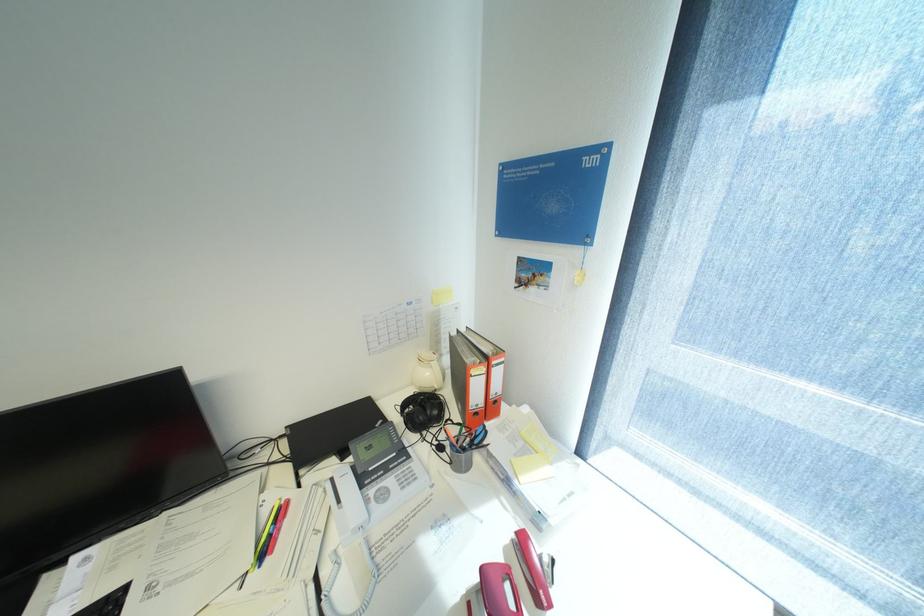
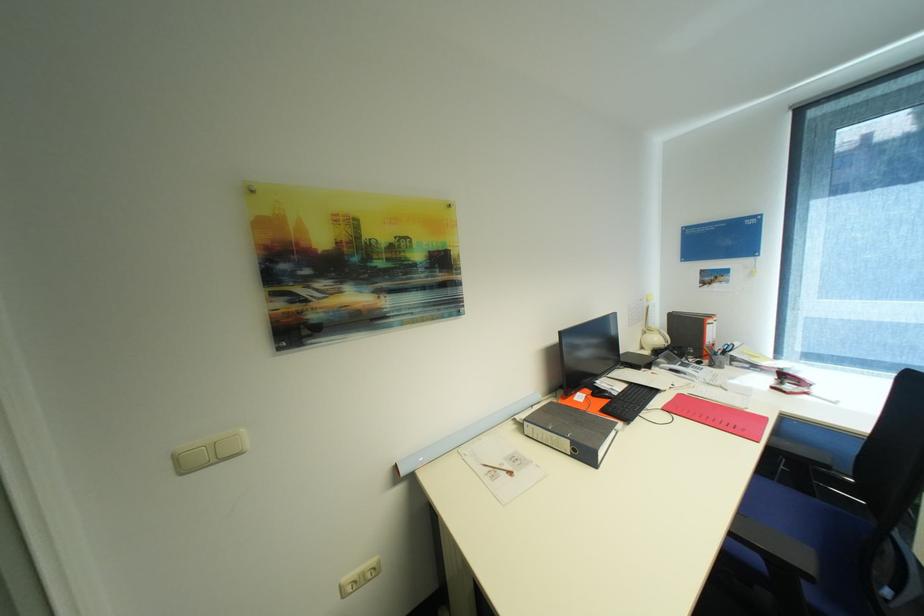
Find the pixel in the second image that matches [436,374] in the first image.

(663, 339)